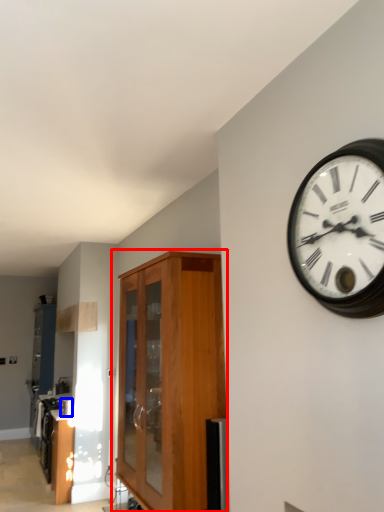
Question: Which of the following is the farthest to the observer, cabinetry (highlighted by a red box) or appliance (highlighted by a blue box)?

Choices:
 (A) cabinetry
 (B) appliance

Answer: (B)